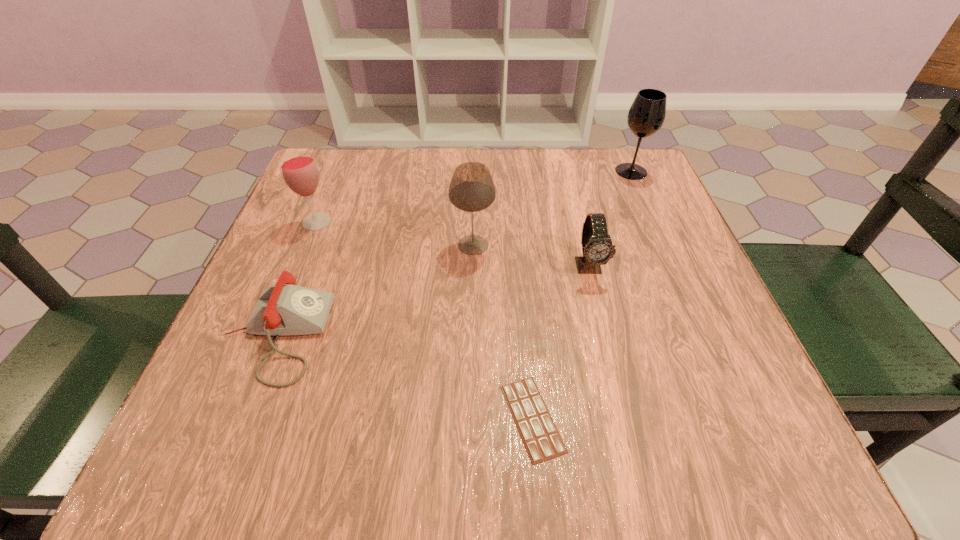
This screenshot has height=540, width=960. Find the location of `the rightmost wineglass`. the rightmost wineglass is located at coordinates (646, 116).

Locate an element on the screen. This screenshot has height=540, width=960. the farthest wineglass is located at coordinates tap(646, 116).

The width and height of the screenshot is (960, 540). I want to click on the second wineglass from left to right, so click(x=472, y=189).

The height and width of the screenshot is (540, 960). I want to click on the leftmost wineglass, so click(299, 170).

You are a GUI agent. You are given a task and a screenshot of the screen. Output one action in this format:
    pyautogui.click(x=<x>, y=<y>)
    Task: Click on the second object from right to left
    The image size is (960, 540).
    Given the screenshot: What is the action you would take?
    pyautogui.click(x=597, y=249)

The image size is (960, 540). I want to click on the fourth tallest object, so click(597, 249).

Where is `the fifth tallest object`? the fifth tallest object is located at coordinates (283, 309).

At what (x,y) coordinates should I click in order to perform the action: click on the fourth object from left to right. Please return your answer as a coordinate pair (x, y). The height and width of the screenshot is (540, 960). Looking at the image, I should click on (540, 436).

You are a GUI agent. You are given a task and a screenshot of the screen. Output one action in this format:
    pyautogui.click(x=<x>, y=<y>)
    Task: Click on the shortest object
    The width and height of the screenshot is (960, 540).
    Given the screenshot: What is the action you would take?
    pyautogui.click(x=540, y=436)

Find the location of a particular element. Image resolution: width=960 pixels, height=540 pixels. free space located on the front of the rightmost object is located at coordinates (691, 310).